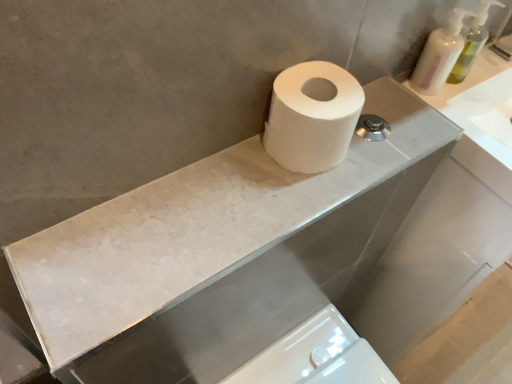
Question: Considering their positions, is white marble counter top at upper center located in front of or behind white matte toilet paper at center?

Choices:
 (A) behind
 (B) front

Answer: (B)

Question: Does point [x=198, y=253] appear closer or farther from the camera than point [x=332, y=66]?

Choices:
 (A) farther
 (B) closer

Answer: (B)

Question: Based on their relative distances, which object is nearer to the white marble counter top at upper center?

Choices:
 (A) white matte toilet paper at center
 (B) white glossy bidet at lower center
 (C) translucent plastic soap dispenser at upper right, positioned as the 2th soap dispenser in right-to-left order
 (D) translucent plastic soap dispenser at upper right, which is the 1th soap dispenser from right to left

Answer: (A)

Question: Considering the real-world distances, which object is closest to the white marble counter top at upper center?

Choices:
 (A) white matte toilet paper at center
 (B) translucent plastic soap dispenser at upper right, which is the first soap dispenser from left to right
 (C) translucent plastic soap dispenser at upper right, which is the 1th soap dispenser from right to left
 (D) white glossy bidet at lower center

Answer: (A)